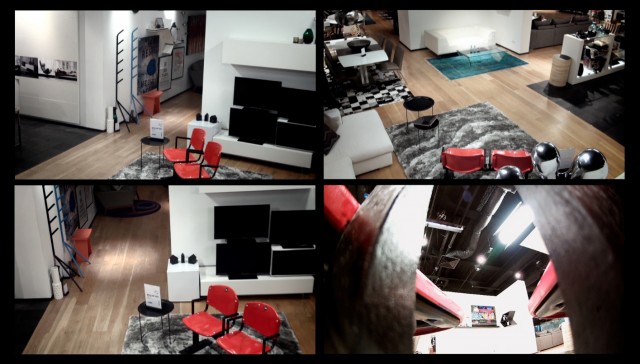
Find the location of a particular element. This screenshot has height=364, width=640. grey rug is located at coordinates (466, 121).